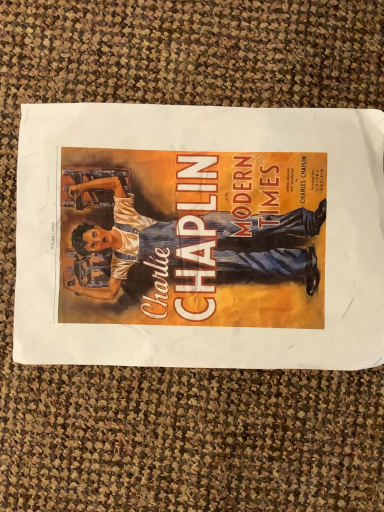
Identify the location of vacant area on top of matte blue overalls at center (from a real-world perspective). The height and width of the screenshot is (512, 384). (208, 230).